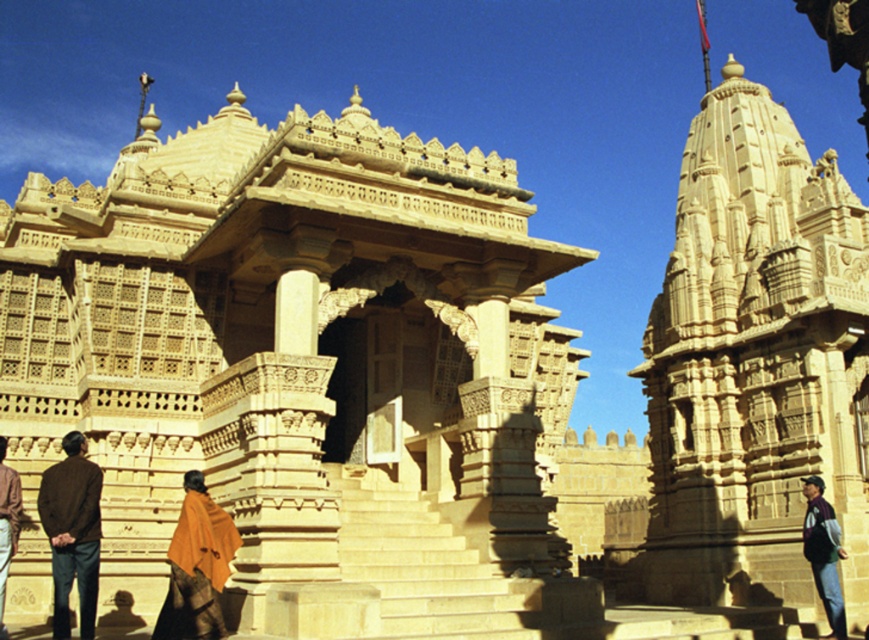
You are an architect visiting the temple complex and notice the beige stone temple at upper right and the dark purple sweater at right. Which object is taller?

The beige stone temple at upper right is taller than the dark purple sweater at right.

You are a visitor at the temple complex and notice two items at the lower left corner. Which item is positioned higher between the brown fabric coat at lower left and the orange fabric shawl at lower left?

The brown fabric coat at lower left is positioned above the orange fabric shawl at lower left.

You are standing in the temple complex and want to place a new statue in front of the beige stone hindu temple at center. If you currently have the statue near the brown fabric coat at lower left, in which direction should you move the statue to place it in front of the temple?

Since the beige stone hindu temple at center is to the right of the brown fabric coat at lower left, you should move the statue to the right to place it in front of the temple.